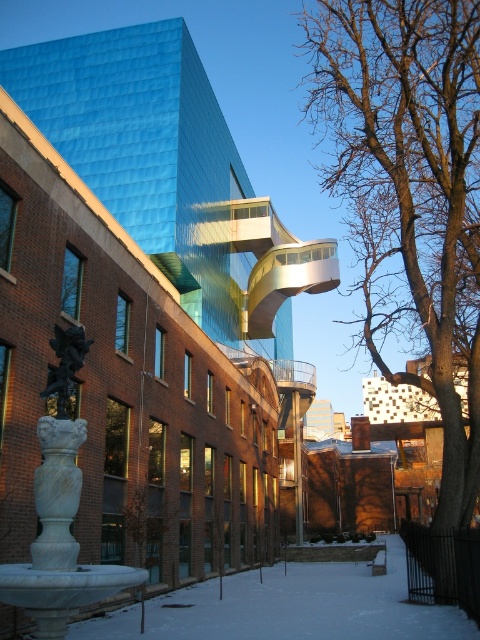
In the scene shown: You are an architect analyzing the winter scene. You notice the bare branches at center and the white powdery snow at lower center. Which object appears bigger in the image?

The bare branches at center has a larger size compared to white powdery snow at lower center, so the bare branches at center appears bigger in the image.

You are standing in the architectural scene described. There is a point marked at coordinates (59, 460). What object is located at that point?

The white marble statue at center is located at point (59, 460).

You are standing at the edge of the scene looking towards the modern building. Which object, the bare branches at center or the white powdery snow at lower center, is positioned to the right of the other?

The bare branches at center are positioned to the right of the white powdery snow at lower center.